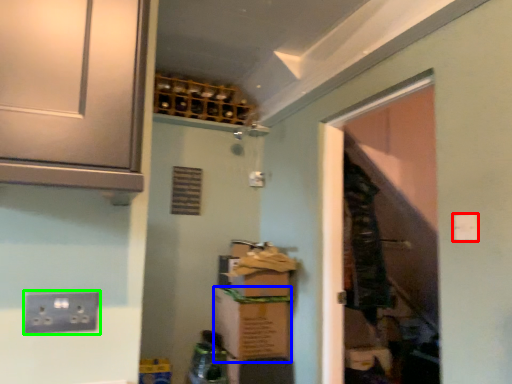
Question: Which is farther away from light switch (highlighted by a red box)? cardboard box (highlighted by a blue box) or electric outlet (highlighted by a green box)?

Choices:
 (A) cardboard box
 (B) electric outlet

Answer: (A)